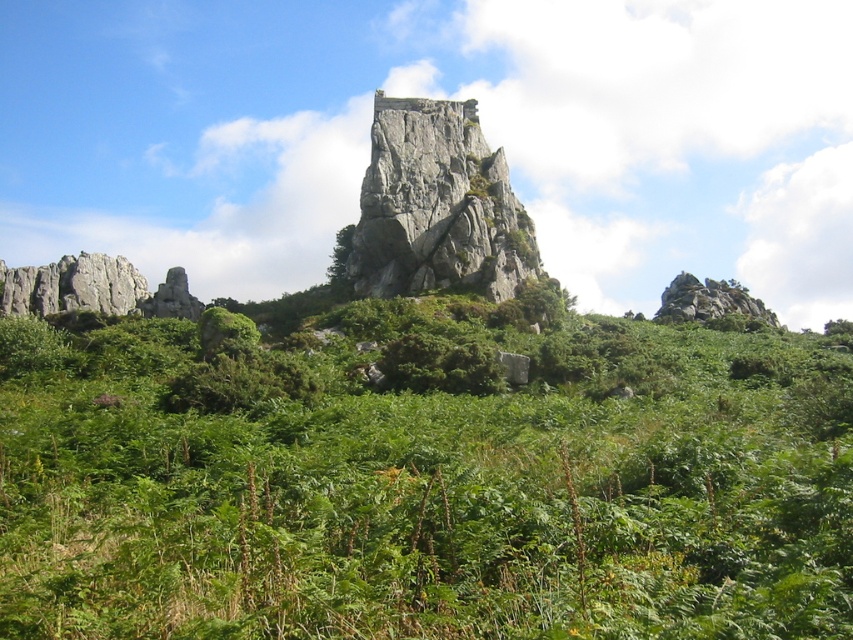
Question: Which object is the closest to the green leafy tree at center?

Choices:
 (A) green leafy shrubs at center
 (B) rugged stone rock at center

Answer: (B)

Question: Is green leafy shrubs at center closer to camera compared to green leafy tree at center?

Choices:
 (A) no
 (B) yes

Answer: (B)

Question: Which object is positioned farthest from the rugged stone rock at center?

Choices:
 (A) green leafy tree at center
 (B) green leafy shrubs at center

Answer: (B)

Question: Among these objects, which one is nearest to the camera?

Choices:
 (A) rugged stone rock at center
 (B) green leafy tree at center
 (C) green leafy shrubs at center

Answer: (C)

Question: Is rugged stone rock at center above green leafy tree at center?

Choices:
 (A) yes
 (B) no

Answer: (A)

Question: Where is green leafy shrubs at center located in relation to rugged stone rock at center in the image?

Choices:
 (A) above
 (B) below

Answer: (B)